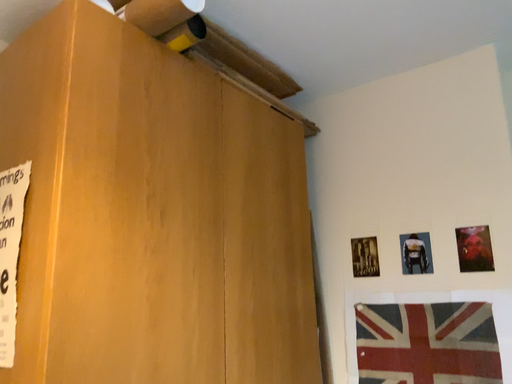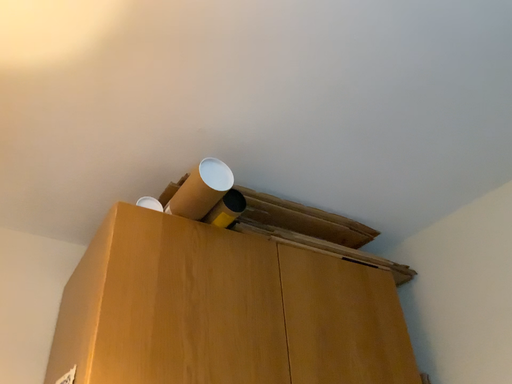
Question: How did the camera likely rotate when shooting the video?

Choices:
 (A) rotated right
 (B) rotated left

Answer: (B)